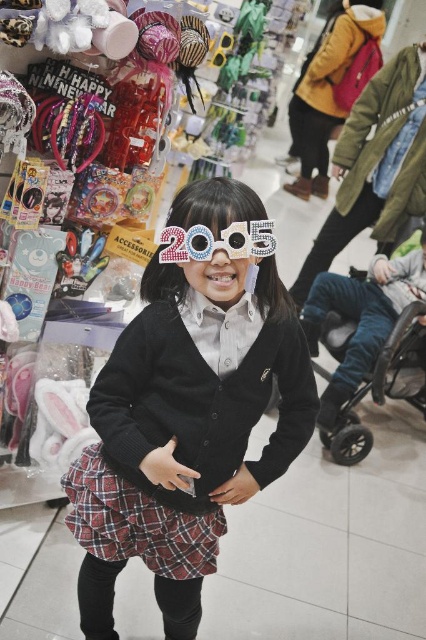
Who is positioned more to the left, black matte sweater at center or plaid fabric skirt at center?

plaid fabric skirt at center

Is black matte sweater at center positioned at the back of plaid fabric skirt at center?

No, black matte sweater at center is closer to the viewer.

Where is `black matte sweater at center`? The height and width of the screenshot is (640, 426). black matte sweater at center is located at coordinates (184, 432).

Identify the location of black matte sweater at center. (184, 432).

Which is above, black matte sweater at center or shiny metallic goggles at center?

Positioned higher is shiny metallic goggles at center.

Can you confirm if black matte sweater at center is shorter than shiny metallic goggles at center?

Incorrect, black matte sweater at center's height does not fall short of shiny metallic goggles at center's.

Who is more distant from viewer, (198, 557) or (212, 246)?

Positioned behind is point (198, 557).

Where is `black matte sweater at center`? black matte sweater at center is located at coordinates (184, 432).

Does plaid fabric skirt at center have a smaller size compared to shiny metallic goggles at center?

No, plaid fabric skirt at center is not smaller than shiny metallic goggles at center.

Does plaid fabric skirt at center have a larger size compared to shiny metallic goggles at center?

Yes.

Which is behind, point (181, 557) or point (175, 248)?

The point (181, 557) is behind.

Where is `plaid fabric skirt at center`? The image size is (426, 640). plaid fabric skirt at center is located at coordinates (138, 522).